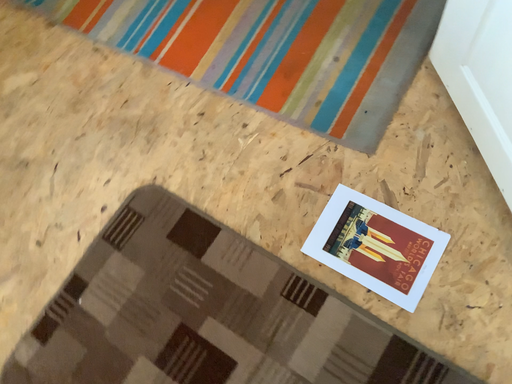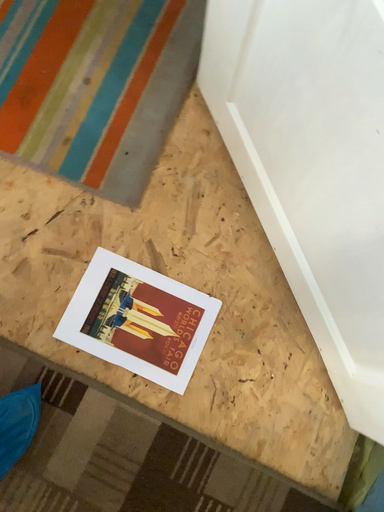
Question: Which way did the camera rotate in the video?

Choices:
 (A) rotated upward
 (B) rotated downward

Answer: (B)